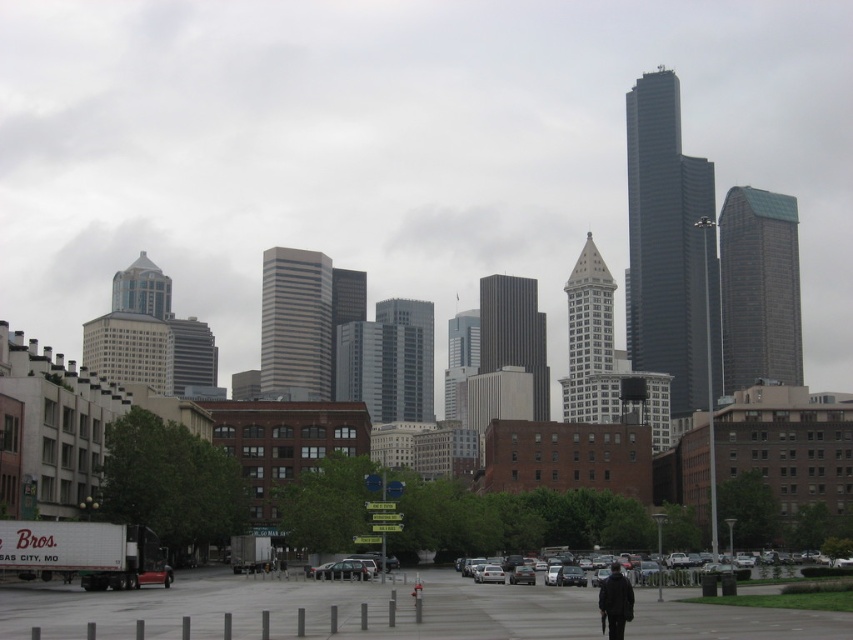
Question: Is silver metallic sedan at center in front of dark blue jacket at center?

Choices:
 (A) yes
 (B) no

Answer: (B)

Question: Which of the following is the farthest from the observer?

Choices:
 (A) gray concrete pavement at center
 (B) silver metallic sedan at center
 (C) dark blue jacket at center

Answer: (B)

Question: Which of the following is the closest to the observer?

Choices:
 (A) (724, 632)
 (B) (343, 560)
 (C) (608, 636)
 (D) (577, 586)

Answer: (C)

Question: Is gray concrete pavement at center wider than metallic silver sedan at center?

Choices:
 (A) no
 (B) yes

Answer: (B)

Question: Is silver metallic sedan at center smaller than metallic silver sedan at center?

Choices:
 (A) yes
 (B) no

Answer: (B)

Question: Which point is closer to the camera taking this photo?

Choices:
 (A) (618, 637)
 (B) (544, 580)

Answer: (A)